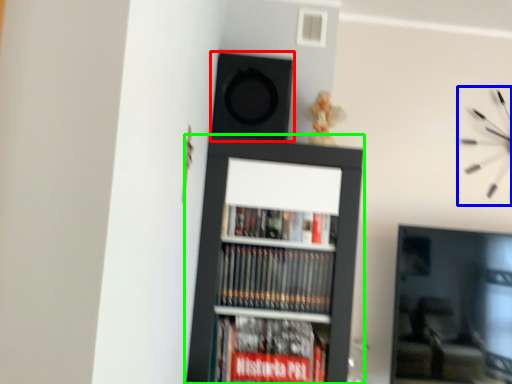
Question: Which object is positioned closest to speaker (highlighted by a red box)? Select from clock (highlighted by a blue box) and bookcase (highlighted by a green box).

Choices:
 (A) clock
 (B) bookcase

Answer: (B)